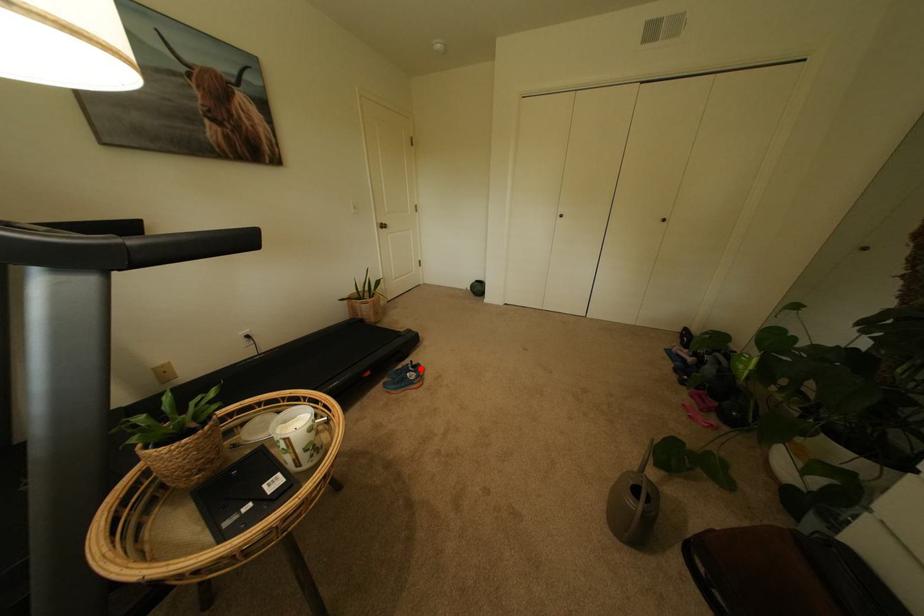
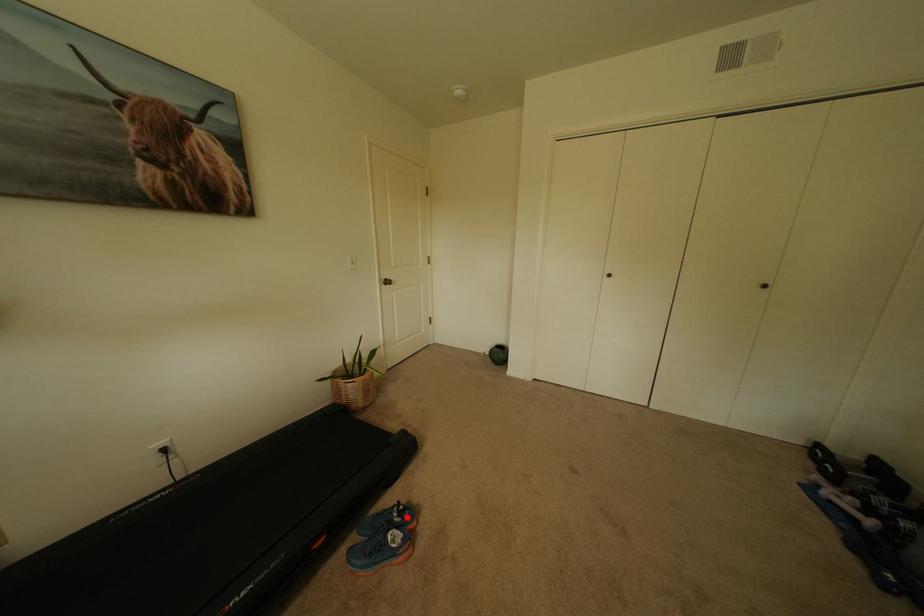
I am providing you with two images of the same scene from different viewpoints. A red point is marked on the first image and another point is marked on the second image. Is the red point in image1 aligned with the point shown in image2?

Yes